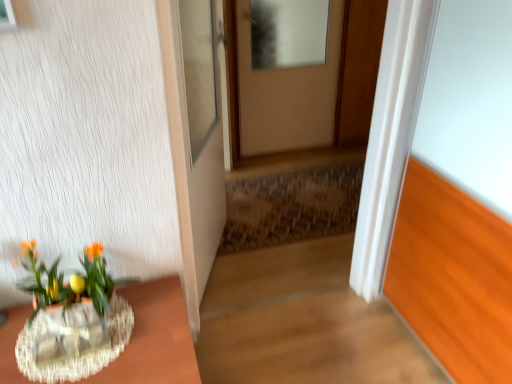
The image size is (512, 384). Identify the location of space that is in front of clear glass vase at lower left. (64, 372).